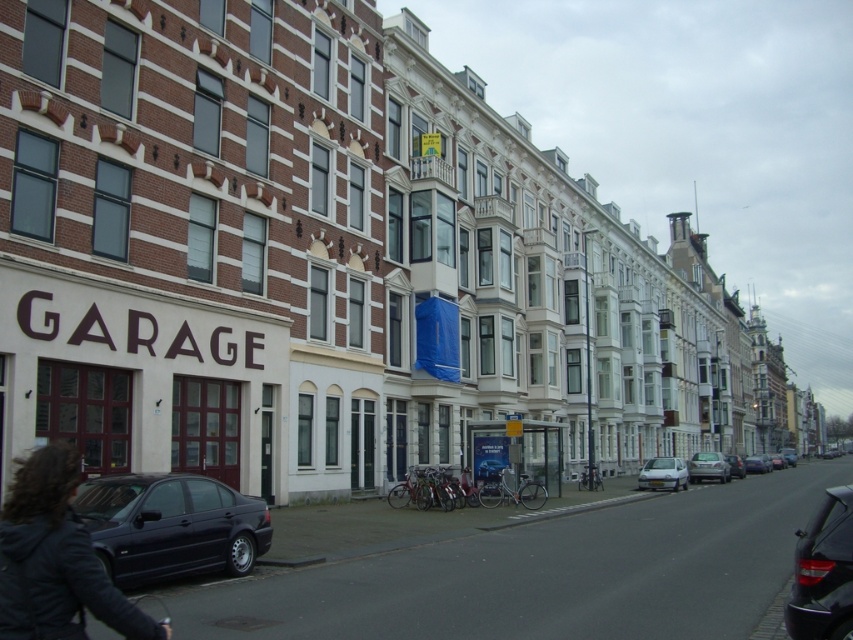
Question: Where is black leather jacket at lower left located in relation to metallic silver sedan at center-right in the image?

Choices:
 (A) above
 (B) below

Answer: (A)

Question: Among these points, which one is farthest from the camera?

Choices:
 (A) (699, 470)
 (B) (656, 476)
 (C) (751, 465)

Answer: (C)

Question: Which object appears farthest from the camera in this image?

Choices:
 (A) metallic silver sedan at right
 (B) black leather jacket at lower left
 (C) silver metallic hatchback at center-right
 (D) silver metallic car at center

Answer: (A)

Question: Can you confirm if shiny black sedan at lower left is smaller than metallic silver sedan at center-right?

Choices:
 (A) no
 (B) yes

Answer: (B)

Question: Is shiny black sedan at lower left closer to camera compared to metallic silver sedan at right?

Choices:
 (A) no
 (B) yes

Answer: (B)

Question: Among these points, which one is farthest from the camera?

Choices:
 (A) (718, 472)
 (B) (730, 454)

Answer: (B)